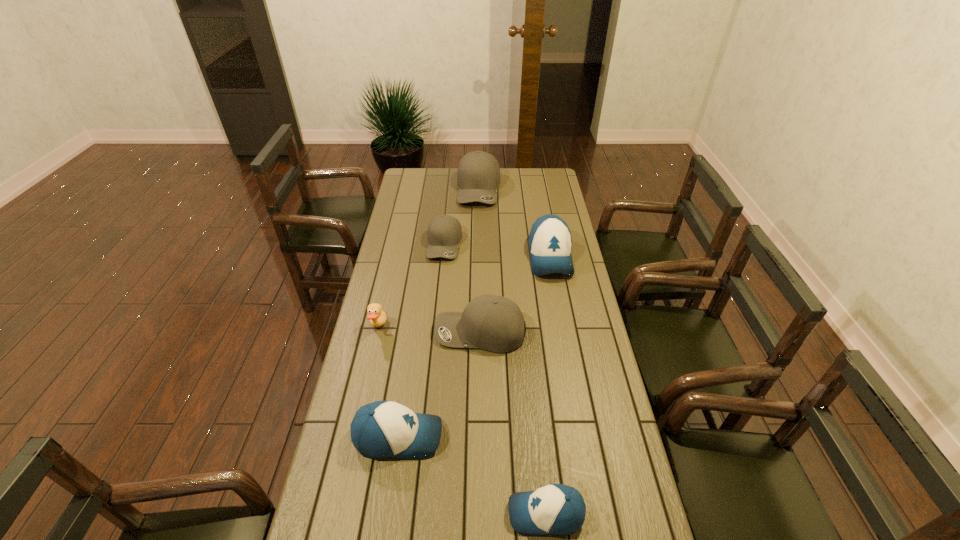
You are a GUI agent. You are given a task and a screenshot of the screen. Output one action in this format:
    pyautogui.click(x=<x>, y=<y>)
    Task: Click on the biggest gray baseball cap
    The image size is (960, 540).
    Given the screenshot: What is the action you would take?
    pyautogui.click(x=478, y=175)

Locate an element on the screen. the farthest object is located at coordinates (478, 175).

Find the location of a particular element. The width and height of the screenshot is (960, 540). the farthest blue baseball cap is located at coordinates (550, 242).

The height and width of the screenshot is (540, 960). I want to click on the second biggest gray baseball cap, so click(x=493, y=323).

Identify the location of the nearest gray baseball cap. The width and height of the screenshot is (960, 540). (493, 323).

You are a GUI agent. You are given a task and a screenshot of the screen. Output one action in this format:
    pyautogui.click(x=<x>, y=<y>)
    Task: Click on the leftmost blue baseball cap
    The height and width of the screenshot is (540, 960).
    Given the screenshot: What is the action you would take?
    (x=381, y=429)

This screenshot has width=960, height=540. What are the coordinates of `the second farthest blue baseball cap` in the screenshot? It's located at (381, 429).

This screenshot has height=540, width=960. Find the location of `the second nearest gray baseball cap`. the second nearest gray baseball cap is located at coordinates (444, 232).

Image resolution: width=960 pixels, height=540 pixels. Identify the location of tan duck. (377, 317).

Locate an element on the screen. This screenshot has height=540, width=960. the smallest blue baseball cap is located at coordinates (557, 509).